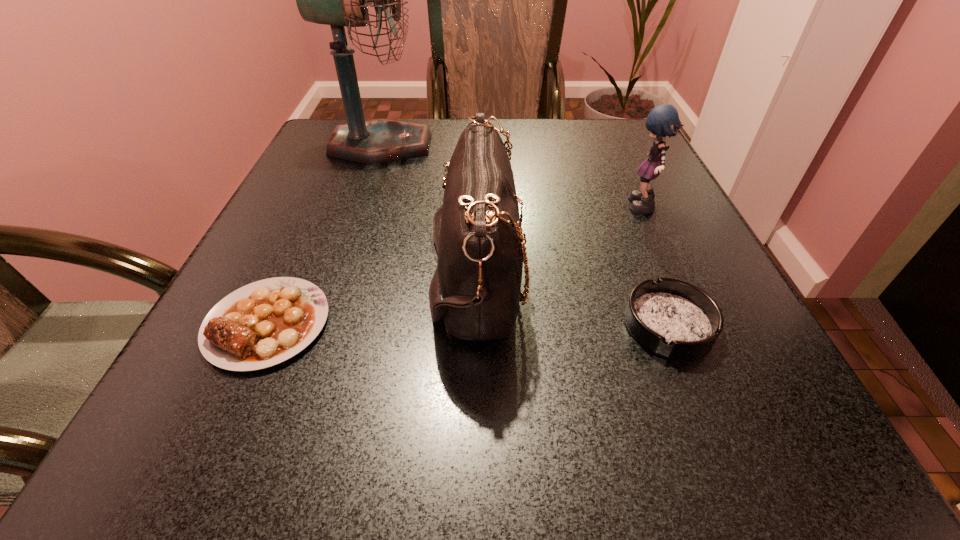
Identify the location of vacant position located 0.210m on the front-facing side of the rag doll. (527, 209).

You are a GUI agent. You are given a task and a screenshot of the screen. Output one action in this format:
    pyautogui.click(x=<x>, y=<y>)
    Task: Click on the free space located 0.160m on the left of the ashtray
    
    Given the screenshot: What is the action you would take?
    pyautogui.click(x=524, y=325)

Where is `vacant space located on the right of the steak`? vacant space located on the right of the steak is located at coordinates (579, 323).

The height and width of the screenshot is (540, 960). Find the location of `object present at the far edge`. object present at the far edge is located at coordinates (338, 0).

You are a GUI agent. You are given a task and a screenshot of the screen. Output one action in this format:
    pyautogui.click(x=<x>, y=<y>)
    Task: Click on the fan positioned at the left edge
    The image size is (960, 540).
    Given the screenshot: What is the action you would take?
    pyautogui.click(x=338, y=0)

Find the location of a particular element. This screenshot has width=960, height=540. steak that is at the left edge is located at coordinates (264, 323).

What are the coordinates of `rag doll located in the right edge section of the desktop` in the screenshot? It's located at (663, 120).

Where is `ashtray present at the right edge`? This screenshot has width=960, height=540. ashtray present at the right edge is located at coordinates 676,319.

The height and width of the screenshot is (540, 960). Identify the location of object present at the far left corner. (338, 0).

This screenshot has width=960, height=540. In the image, there is a desktop. Find the location of `vacant area at the far edge`. vacant area at the far edge is located at coordinates (557, 156).